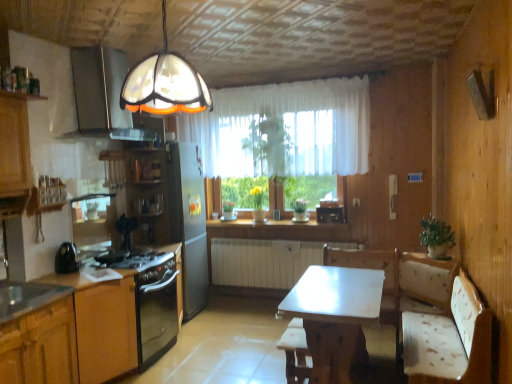
The height and width of the screenshot is (384, 512). In order to click on vacant space in front of black glossy kettle at left in this screenshot , I will do `click(61, 277)`.